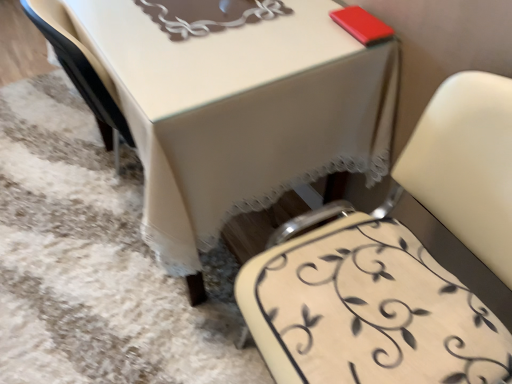
At what (x,y) coordinates should I click in order to perform the action: click on vacant space situated above creamy leather chair at lower right (from a real-world perspective). Please return your answer as a coordinate pair (x, y). Looking at the image, I should click on click(x=387, y=313).